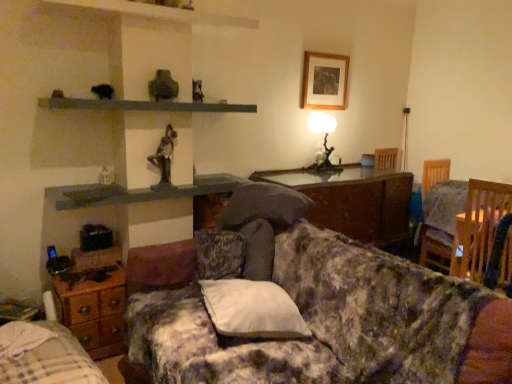
Question: Can you confirm if wooden picture frame at upper center is thinner than wooden bed frame at lower left?

Choices:
 (A) no
 (B) yes

Answer: (B)

Question: Can you confirm if wooden picture frame at upper center is shorter than wooden bed frame at lower left?

Choices:
 (A) yes
 (B) no

Answer: (A)

Question: Can you confirm if wooden picture frame at upper center is positioned to the right of wooden bed frame at lower left?

Choices:
 (A) no
 (B) yes

Answer: (B)

Question: Is wooden picture frame at upper center next to wooden bed frame at lower left?

Choices:
 (A) yes
 (B) no

Answer: (B)

Question: Is wooden picture frame at upper center further to camera compared to wooden bed frame at lower left?

Choices:
 (A) no
 (B) yes

Answer: (B)

Question: Does wooden picture frame at upper center have a smaller size compared to wooden bed frame at lower left?

Choices:
 (A) no
 (B) yes

Answer: (B)

Question: Is wooden picture frame at upper center bigger than wooden drawer at lower left, the first table positioned from the left?

Choices:
 (A) no
 (B) yes

Answer: (A)

Question: From a real-world perspective, is wooden picture frame at upper center beneath wooden drawer at lower left, the first table positioned from the left?

Choices:
 (A) no
 (B) yes

Answer: (A)

Question: Could wooden drawer at lower left, arranged as the 1th table when ordered from the bottom, be considered to be inside wooden picture frame at upper center?

Choices:
 (A) no
 (B) yes

Answer: (A)

Question: Is wooden picture frame at upper center shorter than wooden drawer at lower left, arranged as the 1th table when ordered from the bottom?

Choices:
 (A) yes
 (B) no

Answer: (B)

Question: Can you confirm if wooden picture frame at upper center is thinner than wooden drawer at lower left, arranged as the second table when viewed from the top?

Choices:
 (A) yes
 (B) no

Answer: (A)

Question: Does wooden picture frame at upper center have a smaller size compared to wooden drawer at lower left, the first table positioned from the left?

Choices:
 (A) no
 (B) yes

Answer: (B)

Question: Is floral fabric couch at center wider than wooden chair at right?

Choices:
 (A) no
 (B) yes

Answer: (B)